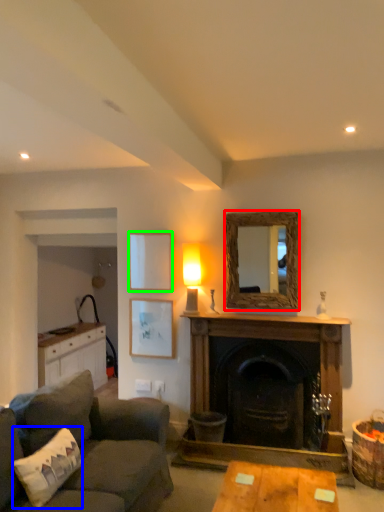
Question: Considering the real-world distances, which object is closest to mirror (highlighted by a red box)? pillow (highlighted by a blue box) or picture frame (highlighted by a green box).

Choices:
 (A) pillow
 (B) picture frame

Answer: (B)